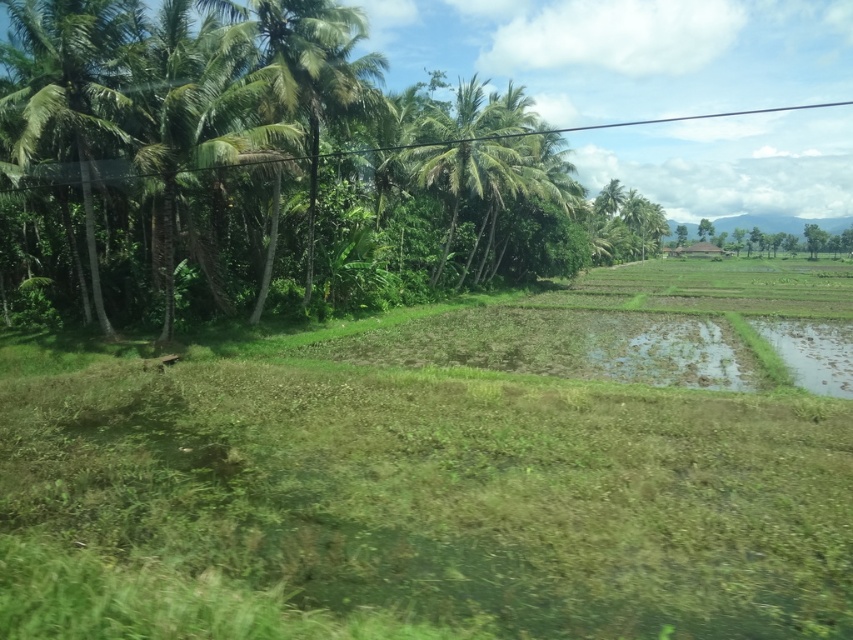
Is point (51, 99) behind point (454, 92)?

No.

Who is positioned more to the left, green leafy palm tree at left or green leafy palm tree at center?

green leafy palm tree at left is more to the left.

Does point (91, 243) lie in front of point (463, 156)?

Yes.

This screenshot has width=853, height=640. In order to click on green leafy palm tree at left in this screenshot , I will do `click(67, 90)`.